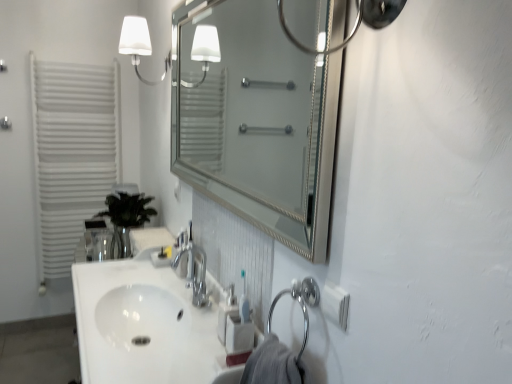
This screenshot has width=512, height=384. What do you see at coordinates (145, 326) in the screenshot?
I see `white glossy sink at center, the second sink in the top-to-bottom sequence` at bounding box center [145, 326].

What is the approximate height of white matte radiator at left?

The height of white matte radiator at left is 5.22 feet.

Locate an element on the screen. white glossy sink at center, the second sink in the top-to-bottom sequence is located at coordinates (145, 326).

Which is in front, point (123, 195) or point (158, 292)?

Positioned in front is point (158, 292).

From a real-world perspective, is green glass vase at left on white glossy sink at center, which is counted as the 1th sink, starting from the bottom?

Yes.

Considering the relative positions of green glass vase at left and white glossy sink at center, the second sink in the top-to-bottom sequence, in the image provided, is green glass vase at left to the left of white glossy sink at center, the second sink in the top-to-bottom sequence, from the viewer's perspective?

Indeed, green glass vase at left is positioned on the left side of white glossy sink at center, the second sink in the top-to-bottom sequence.

Considering the sizes of green glass vase at left and white glossy sink at center, the second sink in the top-to-bottom sequence, in the image, is green glass vase at left wider or thinner than white glossy sink at center, the second sink in the top-to-bottom sequence,?

green glass vase at left is thinner than white glossy sink at center, the second sink in the top-to-bottom sequence.

Could you tell me if polished chrome faucet at center is turned towards chrome metallic faucet at center?

No, polished chrome faucet at center is not turned towards chrome metallic faucet at center.

Would you consider polished chrome faucet at center to be distant from chrome metallic faucet at center?

That's not correct — polished chrome faucet at center is a little close to chrome metallic faucet at center.

Between polished chrome faucet at center and chrome metallic faucet at center, which one has larger width?

chrome metallic faucet at center is wider.

Is polished chrome faucet at center positioned before chrome metallic faucet at center?

No, it is not.

Does white plastic soap dispenser at lower center come in front of white glossy sink at center, the second sink ordered from the bottom?

No, the depth of white plastic soap dispenser at lower center is greater than that of white glossy sink at center, the second sink ordered from the bottom.

Based on the photo, does white plastic soap dispenser at lower center have a lesser height compared to white glossy sink at center, the second sink ordered from the bottom?

Yes, white plastic soap dispenser at lower center is shorter than white glossy sink at center, the second sink ordered from the bottom.

How much distance is there between white plastic soap dispenser at lower center and white glossy sink at center, the second sink ordered from the bottom?

white plastic soap dispenser at lower center is 11.07 inches from white glossy sink at center, the second sink ordered from the bottom.

From the image's perspective, between white plastic soap dispenser at lower center and white glossy sink at center, the second sink ordered from the bottom, which one is located above?

white plastic soap dispenser at lower center appears higher in the image.

Which object is positioned more to the left, silver/metallic mirror at center or white glossy sink at center, which is counted as the 1th sink, starting from the bottom?

white glossy sink at center, which is counted as the 1th sink, starting from the bottom.

Is silver/metallic mirror at center positioned beyond the bounds of white glossy sink at center, the second sink in the top-to-bottom sequence?

That's correct, silver/metallic mirror at center is outside of white glossy sink at center, the second sink in the top-to-bottom sequence.

In terms of size, does silver/metallic mirror at center appear bigger or smaller than white glossy sink at center, the second sink in the top-to-bottom sequence?

Clearly, silver/metallic mirror at center is smaller in size than white glossy sink at center, the second sink in the top-to-bottom sequence.

Identify the location of the 1st sink behind the silver/metallic mirror at center, starting your count from the anchor. (145, 326).

Is point (125, 47) positioned behind point (117, 287)?

Yes, it is behind point (117, 287).

Between white matte wall sconce at upper left and white glossy sink at center, the second sink ordered from the bottom, which one has larger size?

white glossy sink at center, the second sink ordered from the bottom, is bigger.

From a real-world perspective, who is located lower, white matte wall sconce at upper left or white glossy sink at center, the first sink viewed from the top?

white glossy sink at center, the first sink viewed from the top.

Where is `the 1st sink in front of the white matte wall sconce at upper left, counting from the anchor's position`? the 1st sink in front of the white matte wall sconce at upper left, counting from the anchor's position is located at coordinates (142, 320).

Is white plastic soap dispenser at lower center far from white glossy sink at center, which is counted as the 1th sink, starting from the bottom?

No, white plastic soap dispenser at lower center is not far from white glossy sink at center, which is counted as the 1th sink, starting from the bottom.

Considering the points (220, 304) and (214, 382), which point is behind, point (220, 304) or point (214, 382)?

Point (220, 304)

In the scene shown: Which is more to the left, white plastic soap dispenser at lower center or white glossy sink at center, which is counted as the 1th sink, starting from the bottom?

white glossy sink at center, which is counted as the 1th sink, starting from the bottom, is more to the left.

Is white plastic soap dispenser at lower center smaller than white glossy sink at center, which is counted as the 1th sink, starting from the bottom?

Correct, white plastic soap dispenser at lower center occupies less space than white glossy sink at center, which is counted as the 1th sink, starting from the bottom.

From the image's perspective, is white glossy sink at center, the second sink ordered from the bottom, located above or below silver/metallic mirror at center?

From the image's perspective, white glossy sink at center, the second sink ordered from the bottom, appears below silver/metallic mirror at center.

Could you tell me if white glossy sink at center, the first sink viewed from the top, is turned towards silver/metallic mirror at center?

No, white glossy sink at center, the first sink viewed from the top, is not facing towards silver/metallic mirror at center.

Is white glossy sink at center, the second sink ordered from the bottom, at the left side of silver/metallic mirror at center?

Yes, white glossy sink at center, the second sink ordered from the bottom, is to the left of silver/metallic mirror at center.

Is white glossy sink at center, the first sink viewed from the top, shorter than silver/metallic mirror at center?

Indeed, white glossy sink at center, the first sink viewed from the top, has a lesser height compared to silver/metallic mirror at center.

In order to click on plant above the white glossy sink at center, which is counted as the 1th sink, starting from the bottom (from a real-world perspective) in this screenshot , I will do point(126,218).

At what (x,y) coordinates should I click in order to perform the action: click on faucet on the left of chrome metallic faucet at center. Please return your answer as a coordinate pair (x, y). The width and height of the screenshot is (512, 384). Looking at the image, I should click on (184, 261).

Which object lies nearer to the anchor point white glossy sink at center, the first sink viewed from the top, white matte radiator at left or white matte wall sconce at upper left?

white matte wall sconce at upper left.

Looking at the image, which one is located closer to chrome metallic faucet at center, white matte radiator at left or white glossy sink at center, the first sink viewed from the top?

Among the two, white glossy sink at center, the first sink viewed from the top, is located nearer to chrome metallic faucet at center.

Which object lies nearer to the anchor point polished chrome faucet at center, chrome metallic faucet at center or green glass vase at left?

chrome metallic faucet at center is closer to polished chrome faucet at center.

From the image, which object appears to be nearer to white glossy sink at center, which is counted as the 1th sink, starting from the bottom, chrome metallic faucet at center or green glass vase at left?

chrome metallic faucet at center is positioned closer to the anchor white glossy sink at center, which is counted as the 1th sink, starting from the bottom.

Based on their spatial positions, is white glossy sink at center, the second sink in the top-to-bottom sequence, or white matte radiator at left closer to silver/metallic mirror at center?

white matte radiator at left lies closer to silver/metallic mirror at center than the other object.

Consider the image. Based on their spatial positions, is white glossy sink at center, the first sink viewed from the top, or chrome metallic faucet at center further from white plastic soap dispenser at lower center?

white glossy sink at center, the first sink viewed from the top, is further to white plastic soap dispenser at lower center.

Considering their positions, is white glossy sink at center, which is counted as the 1th sink, starting from the bottom, positioned further to white matte radiator at left than green glass vase at left?

Based on the image, white glossy sink at center, which is counted as the 1th sink, starting from the bottom, appears to be further to white matte radiator at left.

Based on their spatial positions, is white plastic soap dispenser at lower center or polished chrome faucet at center closer to white glossy sink at center, the second sink ordered from the bottom?

polished chrome faucet at center lies closer to white glossy sink at center, the second sink ordered from the bottom, than the other object.

Where is `tap between silver/metallic mirror at center and white matte radiator at left along the z-axis`? The height and width of the screenshot is (384, 512). tap between silver/metallic mirror at center and white matte radiator at left along the z-axis is located at coordinates (195, 272).

Where is `soap dispenser between white glossy sink at center, the first sink viewed from the top, and white matte radiator at left from front to back`? soap dispenser between white glossy sink at center, the first sink viewed from the top, and white matte radiator at left from front to back is located at coordinates (226, 311).

This screenshot has width=512, height=384. I want to click on faucet between white glossy sink at center, the first sink viewed from the top, and green glass vase at left in the front-back direction, so click(184, 261).

At what (x,y) coordinates should I click in order to perform the action: click on soap dispenser positioned between silver/metallic mirror at center and white matte radiator at left from near to far. Please return your answer as a coordinate pair (x, y). The image size is (512, 384). Looking at the image, I should click on (226, 311).